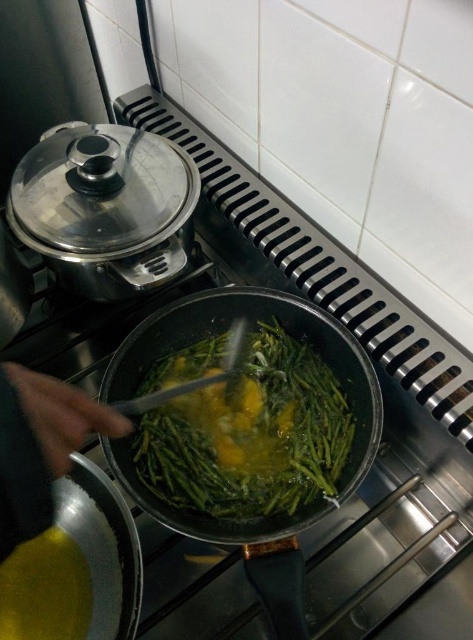
Can you confirm if non-stick dark green frying pan at center is wider than skinny yellow hand at lower left?

Yes.

Does non-stick dark green frying pan at center have a lesser height compared to skinny yellow hand at lower left?

Incorrect, non-stick dark green frying pan at center's height does not fall short of skinny yellow hand at lower left's.

Between point (268, 378) and point (8, 440), which one is positioned in front?

Positioned in front is point (8, 440).

Where is `non-stick dark green frying pan at center`? non-stick dark green frying pan at center is located at coordinates (247, 429).

Does green matte vegetables at center appear over skinny yellow hand at lower left?

Actually, green matte vegetables at center is below skinny yellow hand at lower left.

Which is more to the right, green matte vegetables at center or skinny yellow hand at lower left?

From the viewer's perspective, green matte vegetables at center appears more on the right side.

Who is more forward, (266,324) or (17,413)?

Positioned in front is point (17,413).

The width and height of the screenshot is (473, 640). I want to click on green matte vegetables at center, so (x=251, y=435).

Can you confirm if non-stick dark green frying pan at center is positioned to the right of green matte vegetables at center?

Yes, non-stick dark green frying pan at center is to the right of green matte vegetables at center.

Which is below, non-stick dark green frying pan at center or green matte vegetables at center?

non-stick dark green frying pan at center is below.

Is point (183, 464) positioned in front of point (208, 474)?

No.

You are a GUI agent. You are given a task and a screenshot of the screen. Output one action in this format:
    pyautogui.click(x=<x>, y=<y>)
    Task: Click on the non-stick dark green frying pan at center
    
    Given the screenshot: What is the action you would take?
    pyautogui.click(x=247, y=429)